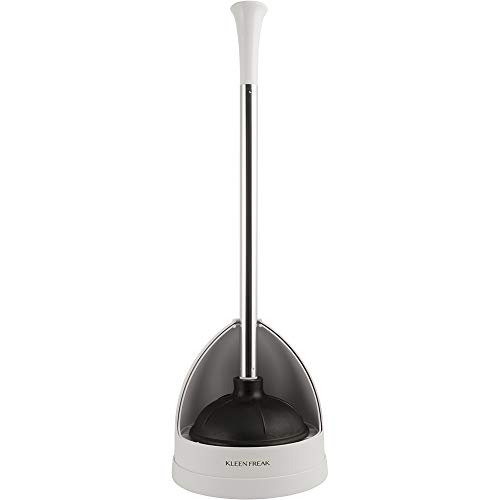
This screenshot has height=500, width=500. Find the location of `place to put plunger`. place to put plunger is located at coordinates (248, 452).